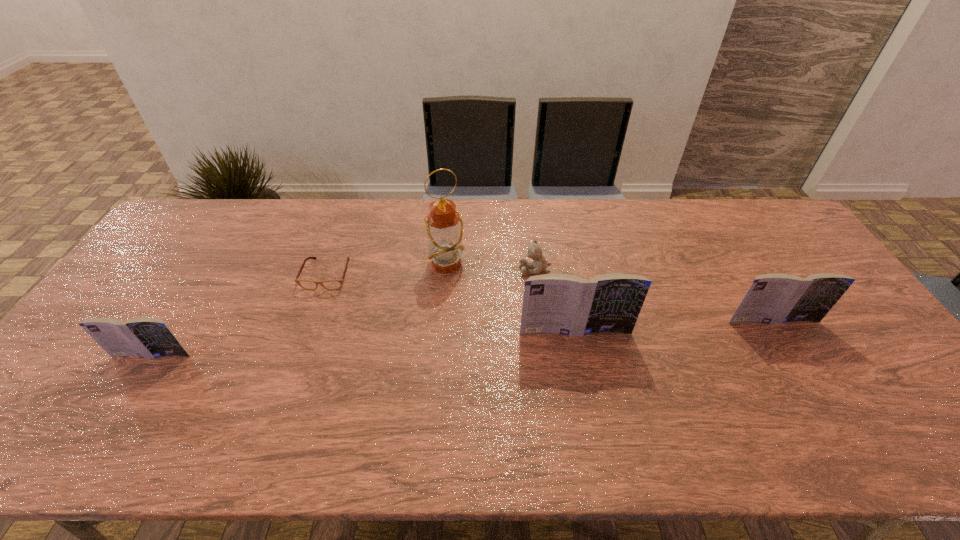
Identify the location of object present at the right edge. (774, 298).

The image size is (960, 540). Identify the location of free space at the far edge. (713, 212).

This screenshot has width=960, height=540. I want to click on vacant region at the near edge of the desktop, so click(305, 390).

This screenshot has height=540, width=960. In the image, there is a desktop. In order to click on free region at the left edge in this screenshot , I will do `click(158, 262)`.

Where is `vacant region at the near left corner`? vacant region at the near left corner is located at coordinates (64, 392).

Locate an element on the screen. vacant area at the far right corner is located at coordinates (763, 237).

The width and height of the screenshot is (960, 540). Find the location of `free space between the spectacles and the leftmost object`. free space between the spectacles and the leftmost object is located at coordinates (240, 315).

The image size is (960, 540). What are the coordinates of `free spot between the fifth farthest object and the fourth tallest object` in the screenshot? It's located at (364, 343).

The height and width of the screenshot is (540, 960). Find the location of `vacant area that lies between the tallest object and the fourth tallest object`. vacant area that lies between the tallest object and the fourth tallest object is located at coordinates coord(300,309).

The height and width of the screenshot is (540, 960). In order to click on unoccupied position between the leftmost object and the shortest object in this screenshot , I will do `click(240, 315)`.